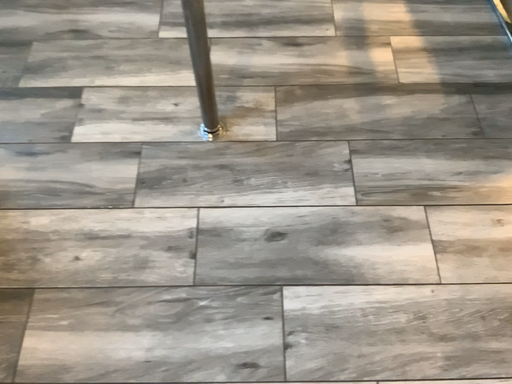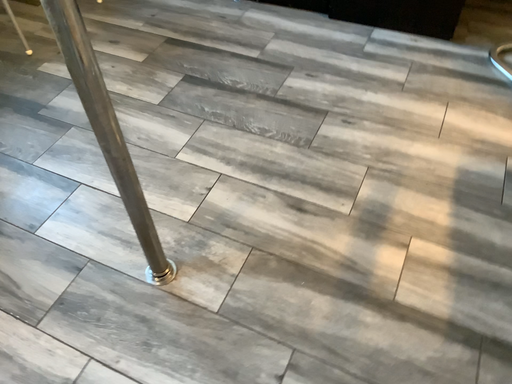
Question: Which way did the camera rotate in the video?

Choices:
 (A) rotated downward
 (B) rotated upward

Answer: (B)